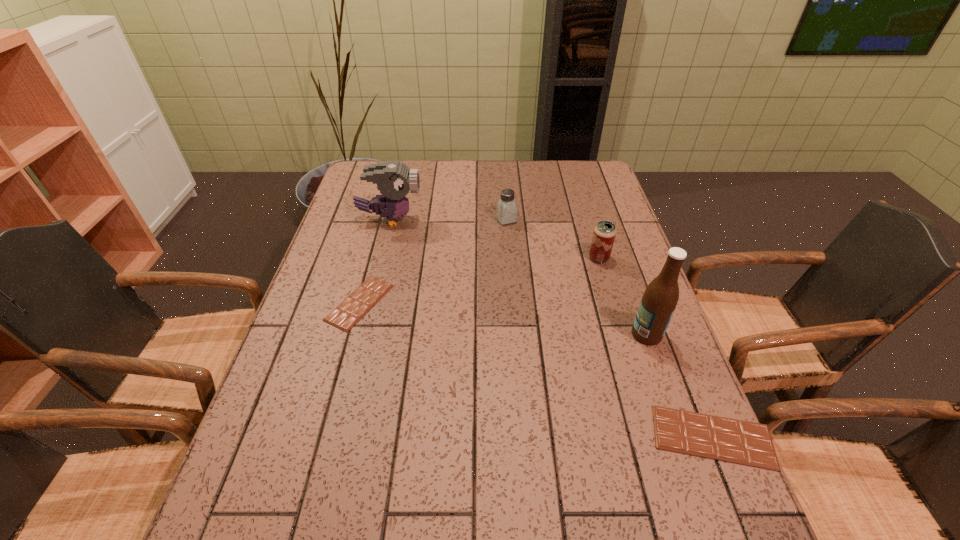
The image size is (960, 540). Identify the location of vacant area between the nearer chocolate bar and the beer bottle. (680, 386).

Locate an element on the screen. This screenshot has width=960, height=540. free space between the saltshaker and the beer bottle is located at coordinates (577, 277).

Identify the location of vacant point located between the beer bottle and the left chocolate bar. (503, 319).

At what (x,y) coordinates should I click in order to perform the action: click on vacant space that is in between the fifth tallest object and the tallest object. Please return your answer as a coordinate pair (x, y). The image size is (960, 540). Looking at the image, I should click on coord(680,386).

Find the location of `vacant area that lies between the right chocolate bar and the farther chocolate bar`. vacant area that lies between the right chocolate bar and the farther chocolate bar is located at coordinates (536, 370).

The width and height of the screenshot is (960, 540). What are the coordinates of `object that stands as the closest to the beer bottle` in the screenshot? It's located at (730, 440).

At what (x,y) coordinates should I click in order to perform the action: click on object that stands as the third closest to the fourth object from right to left. Please return your answer as a coordinate pair (x, y). The width and height of the screenshot is (960, 540). Looking at the image, I should click on (362, 299).

Locate an element on the screen. The image size is (960, 540). vacant space that satisfies the following two spatial constraints: 1. at the beak of the bird; 2. on the right side of the third farthest object is located at coordinates (380, 258).

Where is `vacant space that satisfies the following two spatial constraints: 1. at the beak of the bird; 2. on the back side of the beer bottle`? The width and height of the screenshot is (960, 540). vacant space that satisfies the following two spatial constraints: 1. at the beak of the bird; 2. on the back side of the beer bottle is located at coordinates (361, 334).

Locate an element on the screen. free space that satisfies the following two spatial constraints: 1. at the beak of the saltshaker; 2. on the right side of the bird is located at coordinates (390, 220).